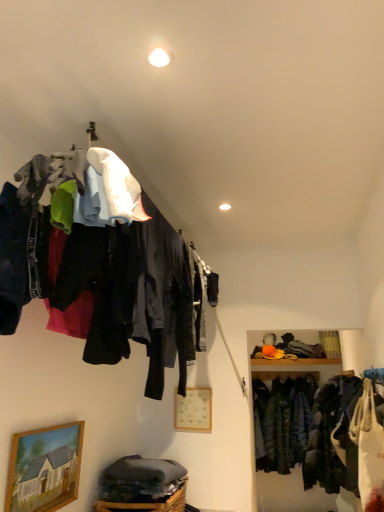
Question: Considering the positions of matte fabric clothes at upper left and wooden picture frame at center, acting as the first picture frame starting from the back, in the image, is matte fabric clothes at upper left bigger or smaller than wooden picture frame at center, acting as the first picture frame starting from the back,?

Choices:
 (A) small
 (B) big

Answer: (B)

Question: Considering the positions of matte fabric clothes at upper left and wooden picture frame at center, which ranks as the 2th picture frame in left-to-right order, in the image, is matte fabric clothes at upper left wider or thinner than wooden picture frame at center, which ranks as the 2th picture frame in left-to-right order,?

Choices:
 (A) thin
 (B) wide

Answer: (B)

Question: Estimate the real-world distances between objects in this image. Which object is closer to the dark green quilted jacket at lower right?

Choices:
 (A) woven brown basket at lower center
 (B) wooden framed painting at lower left, which ranks as the first picture frame in front-to-back order
 (C) matte fabric clothes at upper left
 (D) wooden picture frame at center, placed as the second picture frame when sorted from front to back

Answer: (D)

Question: Considering the real-world distances, which object is farthest from the woven brown basket at lower center?

Choices:
 (A) wooden picture frame at center, the first picture frame when ordered from right to left
 (B) matte fabric clothes at upper left
 (C) dark green quilted jacket at lower right
 (D) wooden framed painting at lower left, the 2th picture frame from the back

Answer: (C)